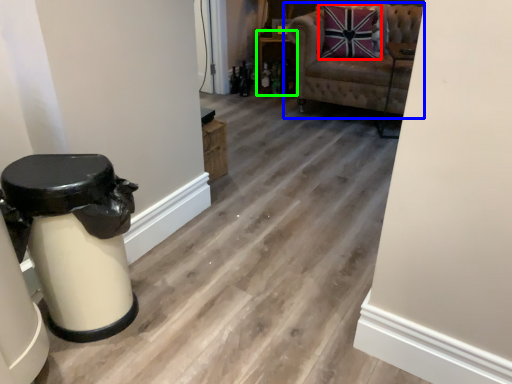
Question: Which object is positioned farthest from pillow (highlighted by a red box)? Select from chair (highlighted by a blue box) and furniture (highlighted by a green box).

Choices:
 (A) chair
 (B) furniture

Answer: (B)